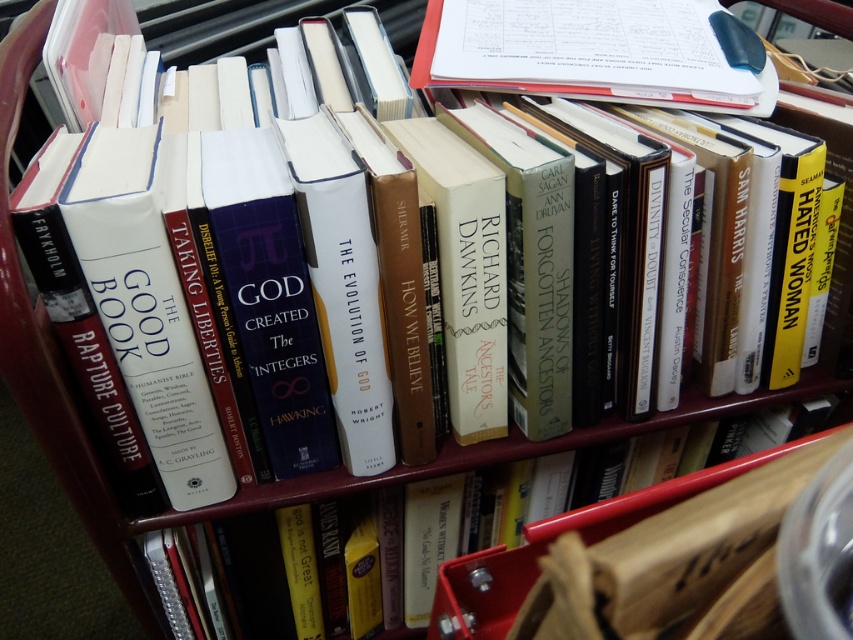
Question: Does white paper notebook at upper center appear under hardcover book at center?

Choices:
 (A) yes
 (B) no

Answer: (B)

Question: Among these points, which one is nearest to the camera?

Choices:
 (A) (577, 529)
 (B) (659, 26)

Answer: (A)

Question: Which of the following is the farthest from the observer?

Choices:
 (A) hardcover book at center
 (B) white paper notebook at upper center

Answer: (B)

Question: Is white paper notebook at upper center smaller than hardcover book at center?

Choices:
 (A) yes
 (B) no

Answer: (B)

Question: Where is white paper notebook at upper center located in relation to hardcover book at center in the image?

Choices:
 (A) right
 (B) left

Answer: (A)